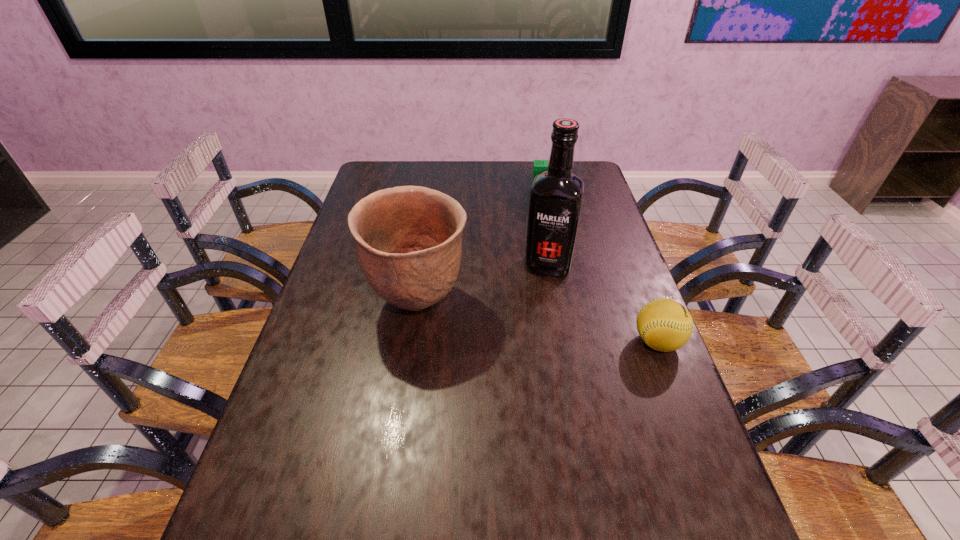
This screenshot has width=960, height=540. Identify the location of vacant area at the far left corner. (405, 162).

The height and width of the screenshot is (540, 960). In the image, there is a desktop. What are the coordinates of `free space at the far right corner` in the screenshot? It's located at (598, 185).

Locate an element on the screen. This screenshot has width=960, height=540. unoccupied area between the alarm clock and the softball is located at coordinates (603, 267).

The width and height of the screenshot is (960, 540). Identify the location of free space that is in between the softball and the leftmost object. (538, 322).

At what (x,y) coordinates should I click in order to perform the action: click on free area in between the softball and the liquor. Please return your answer as a coordinate pair (x, y). Looking at the image, I should click on point(603,303).

At what (x,y) coordinates should I click in order to perform the action: click on vacant region between the liquor and the rightmost object. Please return your answer as a coordinate pair (x, y). The image size is (960, 540). Looking at the image, I should click on (603, 303).

Where is `vacant space that's between the tallest object and the softball`? This screenshot has width=960, height=540. vacant space that's between the tallest object and the softball is located at coordinates (603, 303).

Identify the location of vacant space that is in between the pottery and the tallest object. Image resolution: width=960 pixels, height=540 pixels. (483, 284).

What are the coordinates of `vacant space that's between the rightmost object and the farthest object` in the screenshot? It's located at (603, 267).

Where is `free space that is in between the leftmost object and the rightmost object`? free space that is in between the leftmost object and the rightmost object is located at coordinates tap(538, 322).